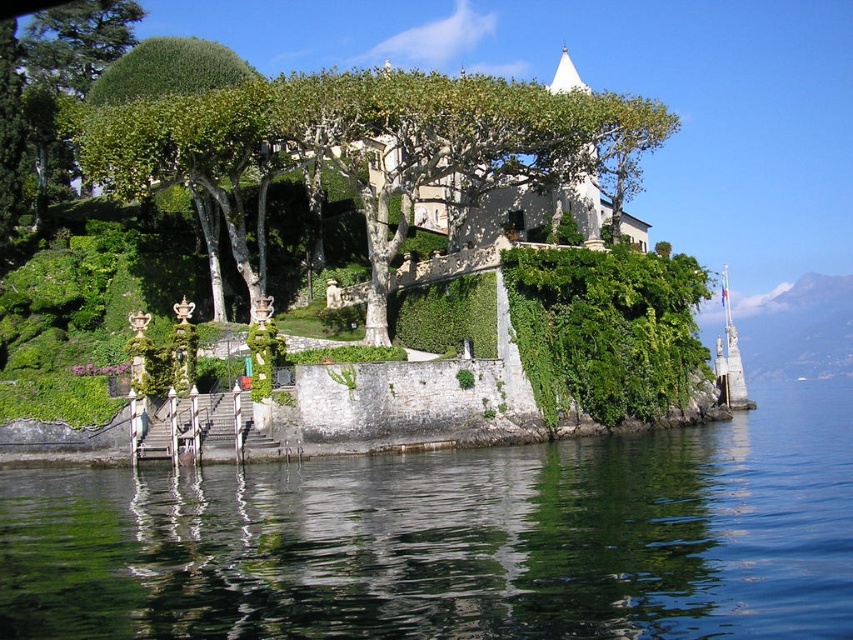
Question: Which of the following is the farthest from the observer?

Choices:
 (A) transparent water at lower center
 (B) green leafy tree at upper center
 (C) green leafy wall at upper center
 (D) green leafy tree at upper left

Answer: (D)

Question: Is transparent water at lower center smaller than green leafy wall at upper center?

Choices:
 (A) no
 (B) yes

Answer: (A)

Question: Which of the following is the closest to the observer?

Choices:
 (A) (276, 136)
 (B) (807, 490)
 (C) (223, 58)
 (D) (659, 248)

Answer: (B)

Question: Does green leafy tree at upper center have a larger size compared to green leafy wall at upper center?

Choices:
 (A) no
 (B) yes

Answer: (B)

Question: Does transparent water at lower center appear under green leafy tree at upper center?

Choices:
 (A) yes
 (B) no

Answer: (A)

Question: Which object is farther from the camera taking this photo?

Choices:
 (A) green leafy wall at upper center
 (B) green leafy tree at upper left
 (C) green leafy tree at upper center

Answer: (B)